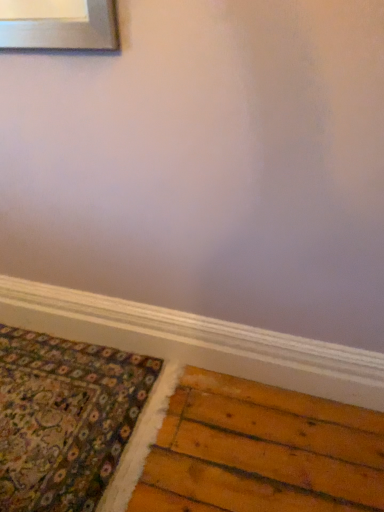
Where is `wooden stairs at lower right`? wooden stairs at lower right is located at coordinates (261, 452).

Based on the photo, measure the distance between point (216, 508) and camera.

Point (216, 508) is 3.78 feet from camera.

What do you see at coordinates (261, 452) in the screenshot? I see `wooden stairs at lower right` at bounding box center [261, 452].

I want to click on wooden stairs at lower right, so click(x=261, y=452).